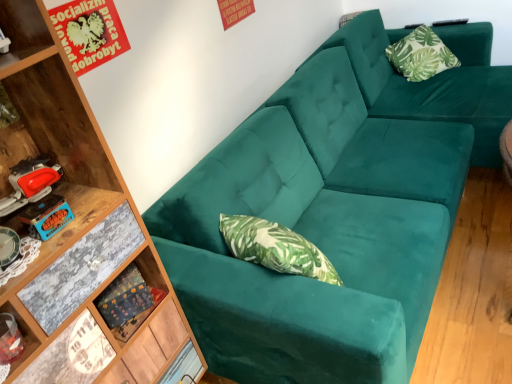
Question: From the image's perspective, relative to wooden shelf at lower left, is green leafy fabric pillow at upper right above or below?

Choices:
 (A) above
 (B) below

Answer: (A)

Question: Is point (421, 44) closer or farther from the camera than point (116, 284)?

Choices:
 (A) closer
 (B) farther

Answer: (B)

Question: Which object is positioned farthest from the wooden shelf at lower left?

Choices:
 (A) teal velvet couch at upper right
 (B) green leafy fabric pillow at upper right

Answer: (B)

Question: Which of these objects is positioned farthest from the teal velvet couch at upper right?

Choices:
 (A) green leafy fabric pillow at upper right
 (B) wooden shelf at lower left

Answer: (B)